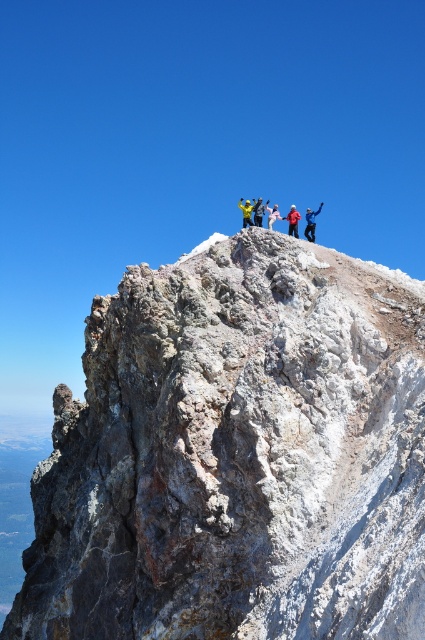
Is white snowboarder at center behind yellow fabric at center?

No, white snowboarder at center is closer to the viewer.

Describe the element at coordinates (311, 221) in the screenshot. I see `white snowboarder at center` at that location.

Does point (308, 240) come behind point (243, 212)?

No, it is not.

Locate an element on the screen. The width and height of the screenshot is (425, 640). white snowboarder at center is located at coordinates (311, 221).

Between white snowboarder at center and matte yellow jacket at center, which one is positioned higher?

white snowboarder at center is above.

How much distance is there between white snowboarder at center and matte yellow jacket at center?

white snowboarder at center and matte yellow jacket at center are 23.69 meters apart.

Does point (314, 224) lie in front of point (299, 218)?

No, (314, 224) is behind (299, 218).

The image size is (425, 640). Identify the location of white snowboarder at center. (311, 221).

What do you see at coordinates (237, 456) in the screenshot? I see `rugged stone mountain at upper center` at bounding box center [237, 456].

Who is positioned more to the right, rugged stone mountain at upper center or yellow fabric jacket at upper center?

yellow fabric jacket at upper center

Which is in front, point (390, 380) or point (269, 211)?

Point (390, 380) is in front.

You are a GUI agent. You are given a task and a screenshot of the screen. Output one action in this format:
    pyautogui.click(x=<x>, y=<y>)
    Task: Click on the rugged stone mountain at upper center
    
    Given the screenshot: What is the action you would take?
    pyautogui.click(x=237, y=456)